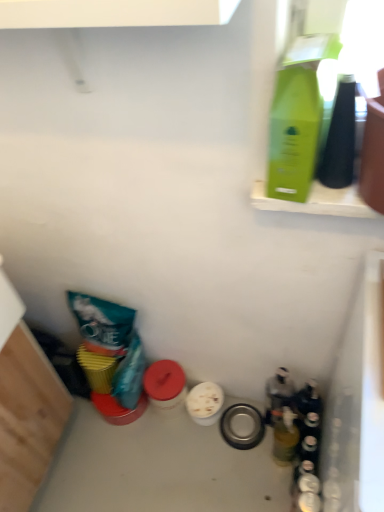
Question: In terms of width, does translucent glass bottle at lower right, the 2th bottle from the back, look wider or thinner when compared to green matte bottle at upper right, the 3th bottle in the back-to-front sequence?

Choices:
 (A) wide
 (B) thin

Answer: (B)

Question: Considering the positions of translucent glass bottle at lower right, the 2th bottle from the back, and green matte bottle at upper right, the 3th bottle in the back-to-front sequence, in the image, is translucent glass bottle at lower right, the 2th bottle from the back, taller or shorter than green matte bottle at upper right, the 3th bottle in the back-to-front sequence,?

Choices:
 (A) tall
 (B) short

Answer: (A)

Question: Based on their relative distances, which object is farther from the translucent glass bottle at lower right, the 2th bottle from the back?

Choices:
 (A) green matte bottle at upper right, which is counted as the first bottle, starting from the front
 (B) translucent glass bottle at lower right, the 1th bottle positioned from the back

Answer: (A)

Question: Which is farther from the translucent glass bottle at lower right, which ranks as the 2th bottle in front-to-back order?

Choices:
 (A) green matte bottle at upper right, the 3th bottle in the back-to-front sequence
 (B) translucent glass bottle at lower right, arranged as the 3th bottle when viewed from the front

Answer: (A)